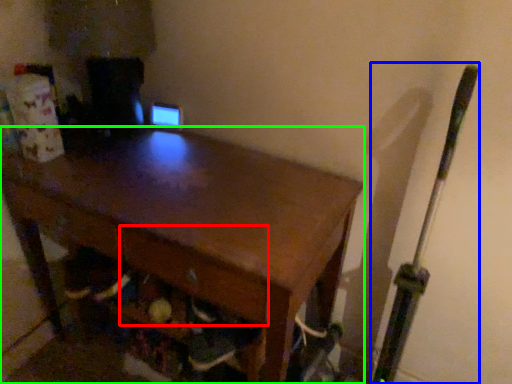
Question: Considering the real-world distances, which object is closest to drawer (highlighted by a red box)? baseball bat (highlighted by a blue box) or desk (highlighted by a green box).

Choices:
 (A) baseball bat
 (B) desk

Answer: (B)